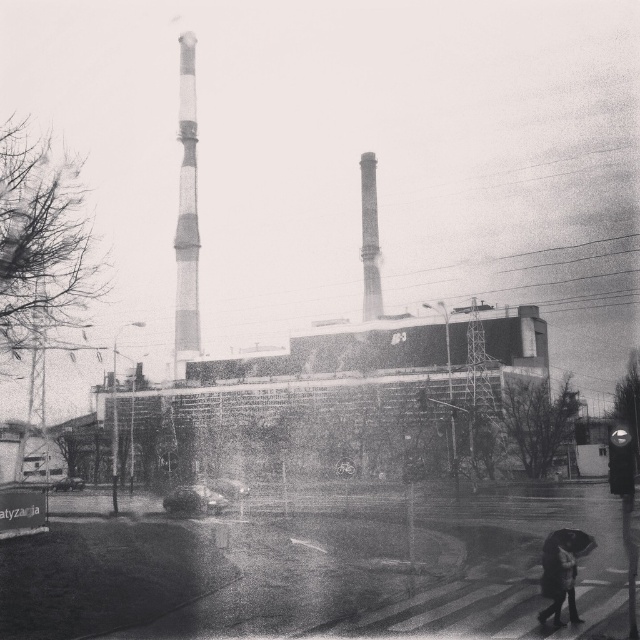
Question: Estimate the real-world distances between objects in this image. Which object is farther from the white striped tower at center?

Choices:
 (A) transparent plastic umbrella at lower right
 (B) dark textured coat at lower right
 (C) smooth concrete chimney at center

Answer: (B)

Question: Can you confirm if smooth concrete chimney at center is wider than transparent plastic umbrella at lower right?

Choices:
 (A) no
 (B) yes

Answer: (A)

Question: Can you confirm if white striped tower at center is positioned below transparent plastic umbrella at lower right?

Choices:
 (A) yes
 (B) no

Answer: (B)

Question: Is dark textured coat at lower right above transparent plastic umbrella at lower right?

Choices:
 (A) no
 (B) yes

Answer: (B)

Question: Considering the real-world distances, which object is closest to the transparent plastic umbrella at lower right?

Choices:
 (A) smooth concrete chimney at center
 (B) dark textured coat at lower right

Answer: (B)

Question: Which of the following is the farthest from the observer?

Choices:
 (A) (572, 547)
 (B) (180, 376)
 (C) (548, 605)
 (D) (372, 294)

Answer: (B)